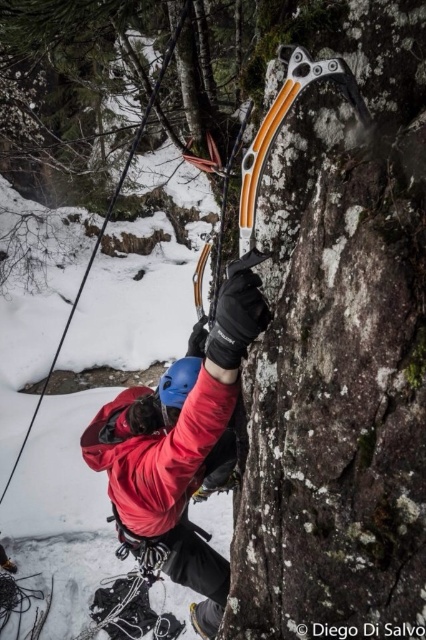
Question: Which object is closer to the camera taking this photo?

Choices:
 (A) matte red jacket at center
 (B) orange plastic ice axe at upper center

Answer: (B)

Question: Can you confirm if matte red jacket at center is positioned to the left of orange plastic ice axe at upper center?

Choices:
 (A) yes
 (B) no

Answer: (A)

Question: Considering the relative positions of matte red jacket at center and orange plastic ice axe at upper center in the image provided, where is matte red jacket at center located with respect to orange plastic ice axe at upper center?

Choices:
 (A) below
 (B) above

Answer: (A)

Question: Does matte red jacket at center appear on the right side of orange plastic ice axe at upper center?

Choices:
 (A) yes
 (B) no

Answer: (B)